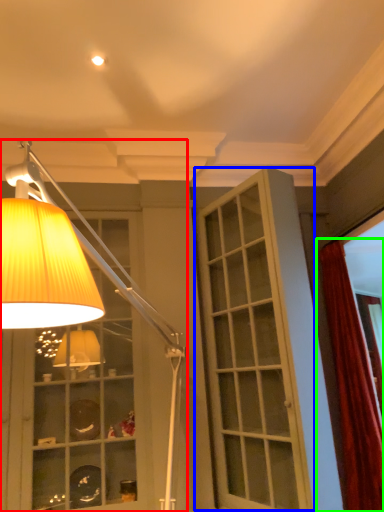
Question: Which object is positioned closest to lamp (highlighted by a red box)? Select from screen door (highlighted by a blue box) and curtain (highlighted by a green box).

Choices:
 (A) screen door
 (B) curtain

Answer: (A)